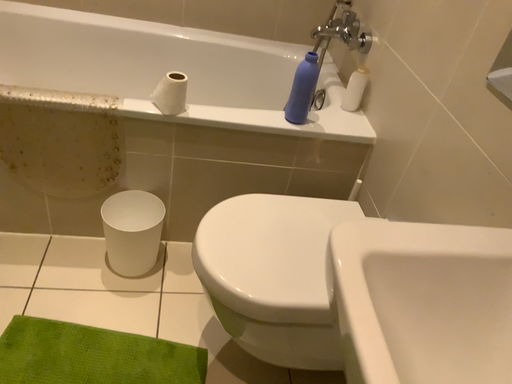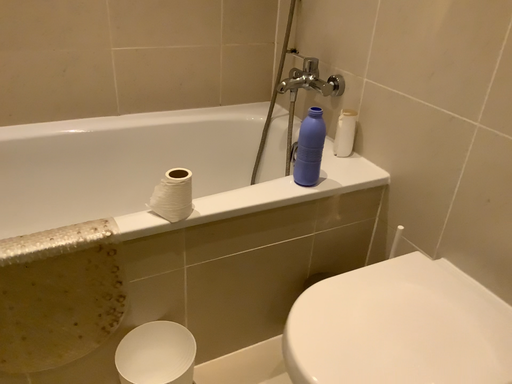
Question: How did the camera likely rotate when shooting the video?

Choices:
 (A) rotated upward
 (B) rotated downward

Answer: (A)